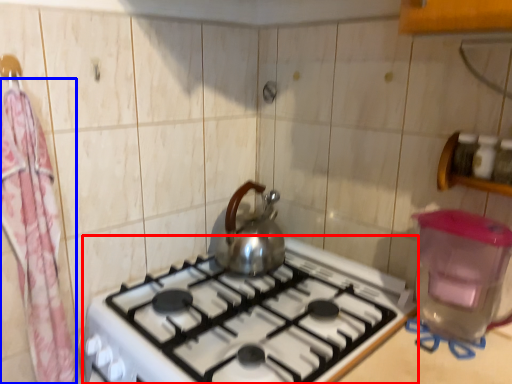
Question: Which object appears farthest to the camera in this image, gas stove (highlighted by a red box) or curtain (highlighted by a blue box)?

Choices:
 (A) gas stove
 (B) curtain

Answer: (B)